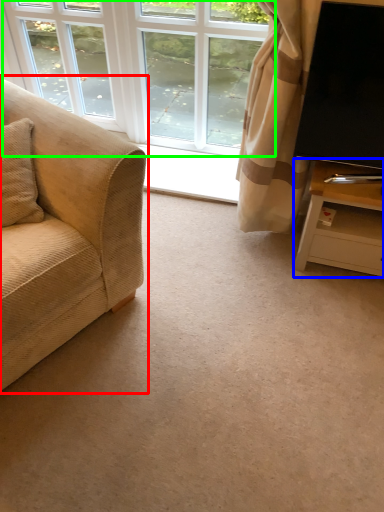
Question: Which object is positioned farthest from studio couch (highlighted by a red box)? Select from table (highlighted by a blue box) and window (highlighted by a green box).

Choices:
 (A) table
 (B) window

Answer: (B)